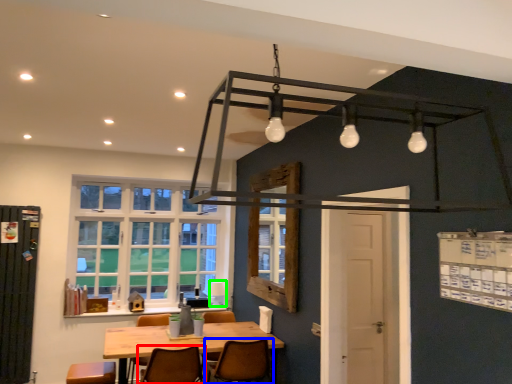
Question: Which object is the farthest from chair (highlighted by a red box)? Choose among these: chair (highlighted by a blue box) or lamp (highlighted by a green box).

Choices:
 (A) chair
 (B) lamp

Answer: (B)